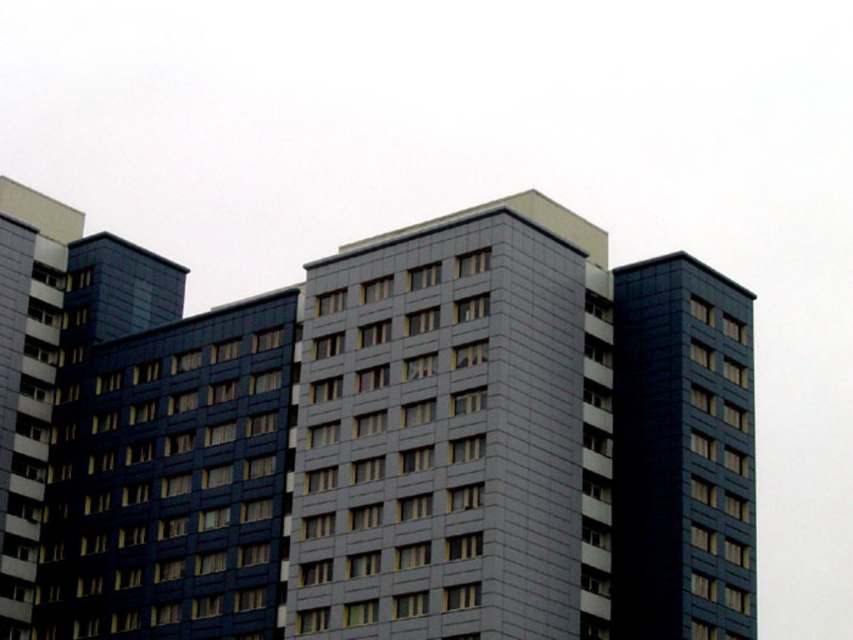
Can you confirm if slate gray concrete building at center is positioned to the left of matte dark blue building at right?

Yes, slate gray concrete building at center is to the left of matte dark blue building at right.

Who is positioned more to the right, slate gray concrete building at center or matte dark blue building at right?

From the viewer's perspective, matte dark blue building at right appears more on the right side.

Where is `slate gray concrete building at center`? This screenshot has height=640, width=853. slate gray concrete building at center is located at coordinates (456, 432).